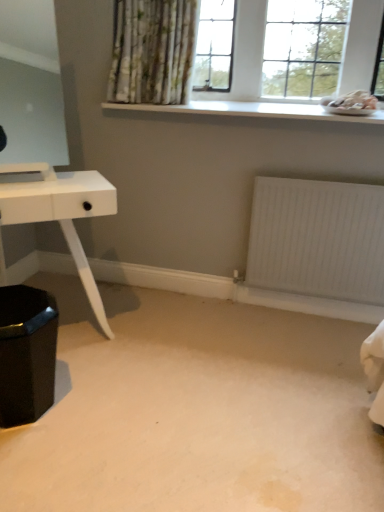
Measure the distance between point (x=83, y=321) and camera.

They are 2.18 meters apart.

What is the approximate width of white textured radiator at lower right?

2.14 inches.

Where is `carpet at center`? The width and height of the screenshot is (384, 512). carpet at center is located at coordinates (196, 410).

Is the surface of white glossy table at left in direct contact with carpet at center?

There is a gap between white glossy table at left and carpet at center.

Based on the photo, is white glossy table at left looking in the opposite direction of carpet at center?

No, carpet at center is not at the back of white glossy table at left.

What's the angular difference between white glossy table at left and carpet at center's facing directions?

The angle between the facing direction of white glossy table at left and the facing direction of carpet at center is 35.9 degrees.

Is white glossy table at left taller than carpet at center?

Yes, white glossy table at left is taller than carpet at center.

Based on their sizes in the image, would you say white textured radiator at lower right is bigger or smaller than white smooth window sill at upper center?

Clearly, white textured radiator at lower right is smaller in size than white smooth window sill at upper center.

Looking at this image, considering the sizes of white textured radiator at lower right and white smooth window sill at upper center in the image, is white textured radiator at lower right taller or shorter than white smooth window sill at upper center?

Considering their sizes, white textured radiator at lower right has more height than white smooth window sill at upper center.

Considering the relative positions of white textured radiator at lower right and white smooth window sill at upper center in the image provided, is white textured radiator at lower right to the right of white smooth window sill at upper center from the viewer's perspective?

Yes, white textured radiator at lower right is to the right of white smooth window sill at upper center.

Which object is wider, white textured radiator at lower right or carpet at center?

carpet at center.

You are a GUI agent. You are given a task and a screenshot of the screen. Output one action in this format:
    pyautogui.click(x=<x>, y=<y>)
    Task: Click on the plain on the left side of white textured radiator at lower right
    
    Given the screenshot: What is the action you would take?
    pyautogui.click(x=196, y=410)

Would you say white textured radiator at lower right contains carpet at center?

Definitely not — carpet at center is not inside white textured radiator at lower right.

From a real-world perspective, between white textured radiator at lower right and white wooden window at upper center, who is vertically higher?

From a 3D spatial view, white wooden window at upper center is above.

The width and height of the screenshot is (384, 512). Find the location of `window behind the white textured radiator at lower right`. window behind the white textured radiator at lower right is located at coordinates (240, 79).

Can you see white textured radiator at lower right touching white wooden window at upper center?

No, white textured radiator at lower right is not touching white wooden window at upper center.

Is white textured radiator at lower right at the left side of white wooden window at upper center?

Incorrect, white textured radiator at lower right is not on the left side of white wooden window at upper center.

Find the location of `plain below the shiny black hexagonal stool at lower left (from a real-world perspective)`. plain below the shiny black hexagonal stool at lower left (from a real-world perspective) is located at coordinates (196, 410).

Between carpet at center and shiny black hexagonal stool at lower left, which one has more height?

Standing taller between the two is shiny black hexagonal stool at lower left.

Is carpet at center beside shiny black hexagonal stool at lower left?

They are not placed beside each other.

From the image's perspective, is carpet at center located above or below shiny black hexagonal stool at lower left?

From the image's perspective, carpet at center appears below shiny black hexagonal stool at lower left.

Considering the positions of point (15, 182) and point (109, 103), is point (15, 182) closer or farther from the camera than point (109, 103)?

Point (15, 182) appears to be closer to the viewer than point (109, 103).

Which object is closer to the camera taking this photo, white glossy table at left or white smooth window sill at upper center?

Positioned in front is white glossy table at left.

From a real-world perspective, is white glossy table at left below white smooth window sill at upper center?

Yes.

From the image's perspective, is white glossy table at left above white smooth window sill at upper center?

No, from the image's perspective, white glossy table at left is not above white smooth window sill at upper center.

Who is bigger, white wooden window at upper center or white glossy table at left?

Bigger between the two is white glossy table at left.

From a real-world perspective, does white wooden window at upper center stand above white glossy table at left?

Yes.

Is white wooden window at upper center completely or partially outside of white glossy table at left?

white wooden window at upper center lies outside white glossy table at left's area.

Identify the location of plain in front of the white glossy table at left. The width and height of the screenshot is (384, 512). (196, 410).

Identify the location of window sill located on the left of white textured radiator at lower right. This screenshot has width=384, height=512. (256, 110).

Looking at the image, which one is located further to carpet at center, white wooden window at upper center or shiny black hexagonal stool at lower left?

The object further to carpet at center is white wooden window at upper center.

Looking at the image, which one is located closer to white wooden window at upper center, white smooth window sill at upper center or white textured radiator at lower right?

Based on the image, white smooth window sill at upper center appears to be nearer to white wooden window at upper center.

Looking at the image, which one is located further to carpet at center, white glossy table at left or shiny black hexagonal stool at lower left?

Based on the image, white glossy table at left appears to be further to carpet at center.

From the image, which object appears to be farther from white textured radiator at lower right, shiny black hexagonal stool at lower left or white glossy table at left?

The object further to white textured radiator at lower right is shiny black hexagonal stool at lower left.

From the image, which object appears to be nearer to carpet at center, white glossy table at left or white smooth window sill at upper center?

white glossy table at left.

When comparing their distances from carpet at center, does white textured radiator at lower right or white wooden window at upper center seem further?

The object further to carpet at center is white wooden window at upper center.

Estimate the real-world distances between objects in this image. Which object is further from carpet at center, white smooth window sill at upper center or white glossy table at left?

white smooth window sill at upper center is positioned further to the anchor carpet at center.

Looking at the image, which one is located closer to carpet at center, white wooden window at upper center or white textured radiator at lower right?

white textured radiator at lower right lies closer to carpet at center than the other object.

You are a GUI agent. You are given a task and a screenshot of the screen. Output one action in this format:
    pyautogui.click(x=<x>, y=<y>)
    Task: Click on the radiator that lies between white smooth window sill at upper center and carpet at center from top to bottom
    Image resolution: width=384 pixels, height=512 pixels.
    Given the screenshot: What is the action you would take?
    pyautogui.click(x=317, y=239)

You are a GUI agent. You are given a task and a screenshot of the screen. Output one action in this format:
    pyautogui.click(x=<x>, y=<y>)
    Task: Click on the step stool between white smooth window sill at upper center and carpet at center vertically
    This screenshot has height=512, width=384.
    Given the screenshot: What is the action you would take?
    pyautogui.click(x=26, y=353)

Where is `table that lies between white smooth window sill at upper center and shiny black hexagonal stool at lower left from top to bottom`? table that lies between white smooth window sill at upper center and shiny black hexagonal stool at lower left from top to bottom is located at coordinates (61, 213).

At what (x,y) coordinates should I click in order to perform the action: click on table situated between shiny black hexagonal stool at lower left and carpet at center from left to right. Please return your answer as a coordinate pair (x, y). Looking at the image, I should click on (61, 213).